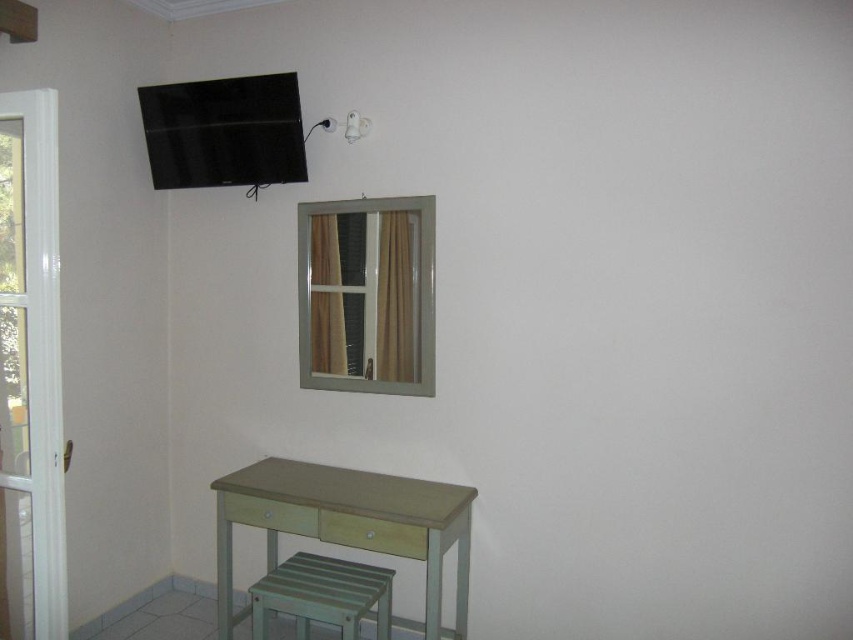
Question: Does light green wooden table at lower left have a greater width compared to matte green stool at lower left?

Choices:
 (A) no
 (B) yes

Answer: (B)

Question: Is metallic frame window at center smaller than matte green stool at lower left?

Choices:
 (A) yes
 (B) no

Answer: (A)

Question: Which point is farther to the camera?

Choices:
 (A) matte green stool at lower left
 (B) metallic frame window at center
 (C) light green wooden table at lower left

Answer: (B)

Question: Among these points, which one is nearest to the camera?

Choices:
 (A) (345, 582)
 (B) (415, 500)

Answer: (A)

Question: Which point is farther from the camera taking this photo?

Choices:
 (A) (287, 529)
 (B) (428, 321)
 (C) (267, 600)

Answer: (B)

Question: Can you confirm if metallic frame window at center is positioned below matte green stool at lower left?

Choices:
 (A) yes
 (B) no

Answer: (B)